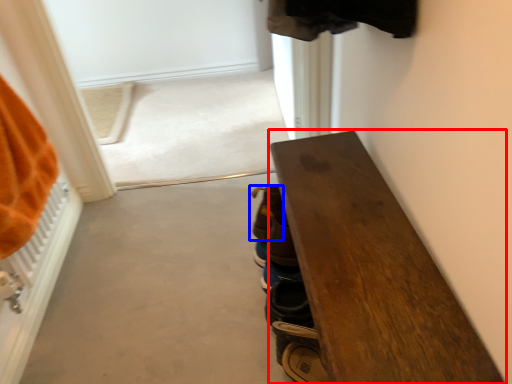
Question: Which point is closer to the camera, furniture (highlighted by a red box) or footwear (highlighted by a blue box)?

Choices:
 (A) furniture
 (B) footwear

Answer: (A)